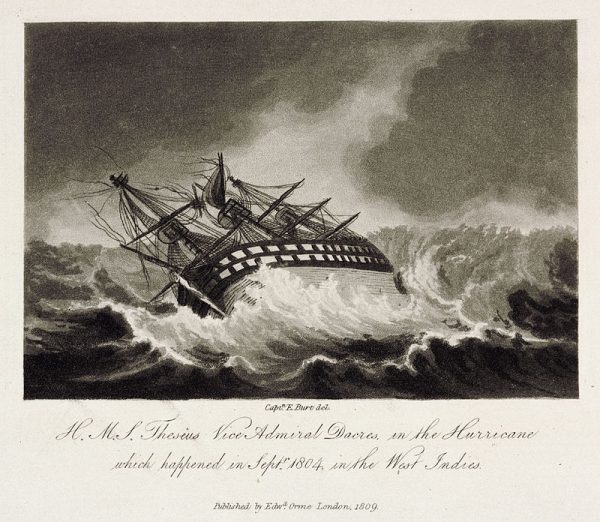
Locate an element on the screen. The width and height of the screenshot is (600, 522). lower left corner of artwork is located at coordinates (23, 396).